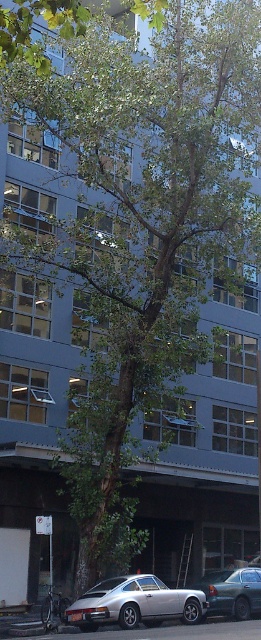
You are a pedestrian standing in front of the large tree. You see a silver metallic car at lower left and a metallic gray sedan at center. Which vehicle is nearer to you?

The silver metallic car at lower left is closer to the viewer than the metallic gray sedan at center.

You are a delivery person standing next to the silver metallic car at lower left, and you need to move your delivery cart to the metallic gray sedan at center. The cart requires a 2.5 meter path to maneuver. Can you safely move your cart through the space between them?

The silver metallic car at lower left and metallic gray sedan at center are 3.07 meters apart. Since the cart needs 2.5 meters to maneuver, there is enough space between them for the cart to pass safely.

You are a delivery driver trying to park your silver metallic car at lower left. There is a metallic gray sedan at center blocking your path. Can you drive around the sedan to reach the parking spot behind it?

The silver metallic car at lower left is located above the metallic gray sedan at center, meaning it is positioned higher up or on a level above. Therefore, you can drive around the sedan to reach the parking spot behind it.